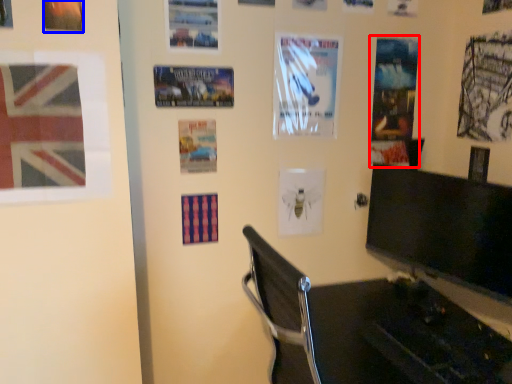
Question: Among these objects, which one is nearest to the camera, poster page (highlighted by a red box) or poster page (highlighted by a blue box)?

Choices:
 (A) poster page
 (B) poster page

Answer: (B)